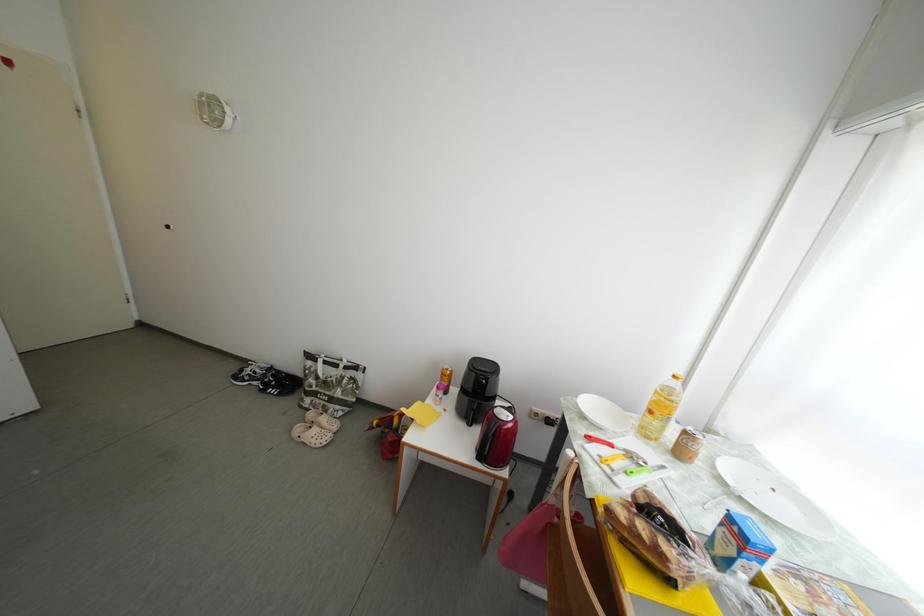
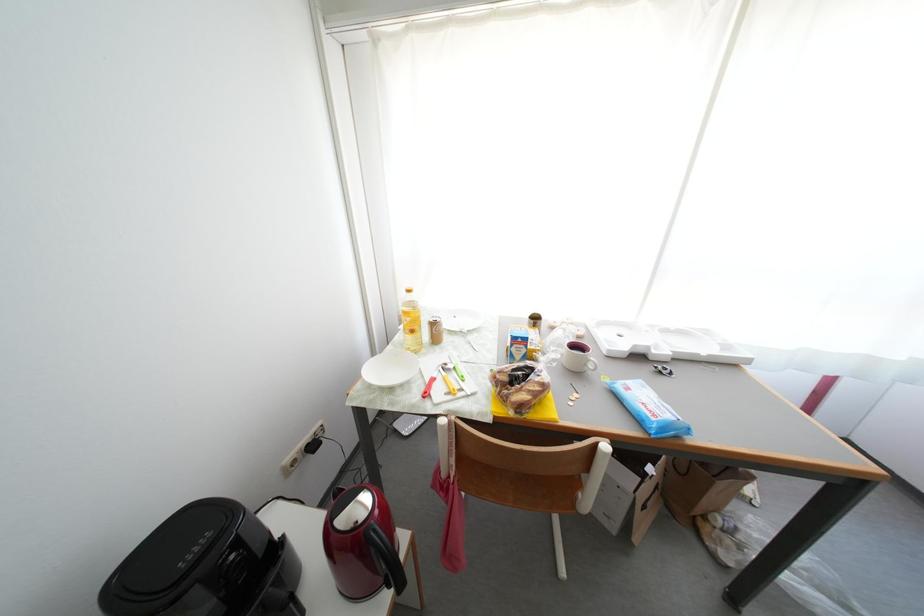
How did the camera likely rotate?

The rotation direction of the camera is right-down.